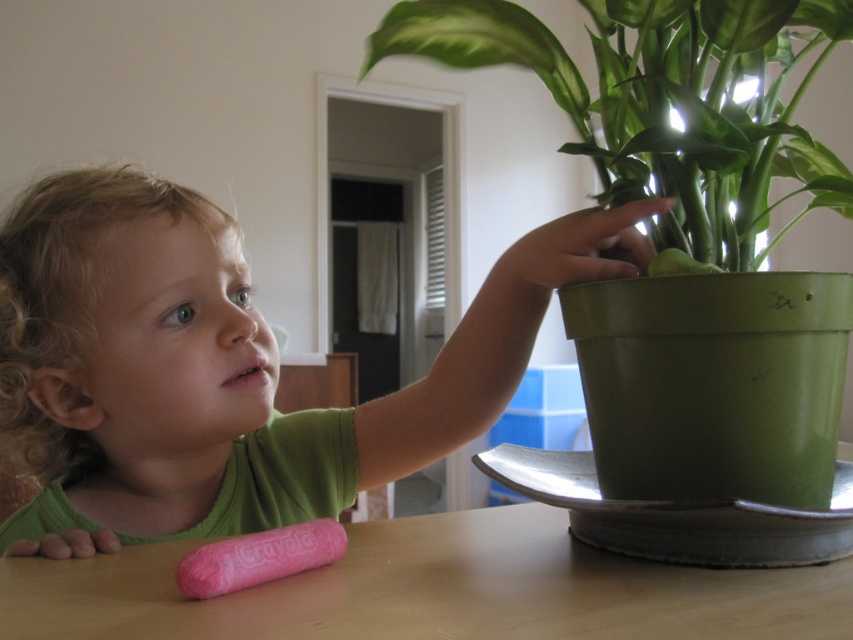
Based on the photo, can you confirm if green matte shirt at upper left is positioned to the right of pink plastic rolling pin at lower left?

No, green matte shirt at upper left is not to the right of pink plastic rolling pin at lower left.

Locate an element on the screen. Image resolution: width=853 pixels, height=640 pixels. green matte shirt at upper left is located at coordinates (x=224, y=368).

Locate an element on the screen. green matte shirt at upper left is located at coordinates (224, 368).

Who is positioned more to the left, green matte shirt at upper left or wooden table at lower center?

green matte shirt at upper left is more to the left.

Identify the location of green matte shirt at upper left. Image resolution: width=853 pixels, height=640 pixels. (224, 368).

Identify the location of green matte shirt at upper left. (224, 368).

Based on the photo, between wooden table at lower center and green matte pot at upper right, which one is positioned lower?

Positioned lower is wooden table at lower center.

Image resolution: width=853 pixels, height=640 pixels. Describe the element at coordinates (431, 589) in the screenshot. I see `wooden table at lower center` at that location.

The image size is (853, 640). What do you see at coordinates (431, 589) in the screenshot?
I see `wooden table at lower center` at bounding box center [431, 589].

Where is `wooden table at lower center`? The image size is (853, 640). wooden table at lower center is located at coordinates (431, 589).